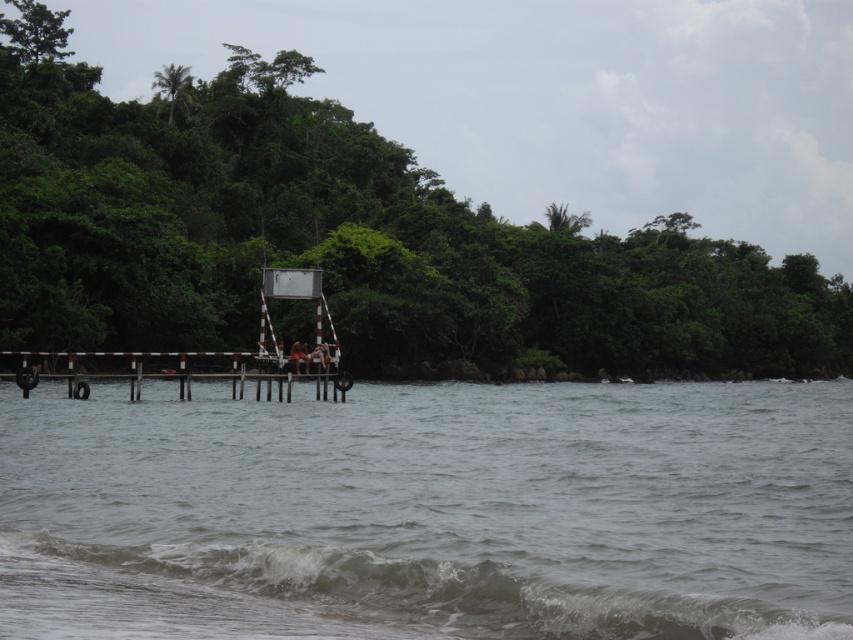
Between gray water at lower left and gray frothy wave at lower center, which one has more height?

Standing taller between the two is gray water at lower left.

Between gray water at lower left and gray frothy wave at lower center, which one appears on the right side from the viewer's perspective?

From the viewer's perspective, gray frothy wave at lower center appears more on the right side.

At what (x,y) coordinates should I click in order to perform the action: click on gray water at lower left. Please return your answer as a coordinate pair (x, y). Image resolution: width=853 pixels, height=640 pixels. Looking at the image, I should click on [430, 513].

Identify the location of gray water at lower left. The height and width of the screenshot is (640, 853). (430, 513).

Between gray water at lower left and smooth skin person at center, which one has less height?

gray water at lower left is shorter.

Who is lower down, gray water at lower left or smooth skin person at center?

gray water at lower left is below.

What do you see at coordinates (430, 513) in the screenshot?
I see `gray water at lower left` at bounding box center [430, 513].

Find the location of a particular element. This screenshot has width=853, height=640. gray water at lower left is located at coordinates (430, 513).

Who is positioned more to the right, blonde hair person at center or smooth skin person at center?

smooth skin person at center

Which is behind, point (300, 342) or point (320, 344)?

The point (320, 344) is more distant.

I want to click on blonde hair person at center, so click(299, 355).